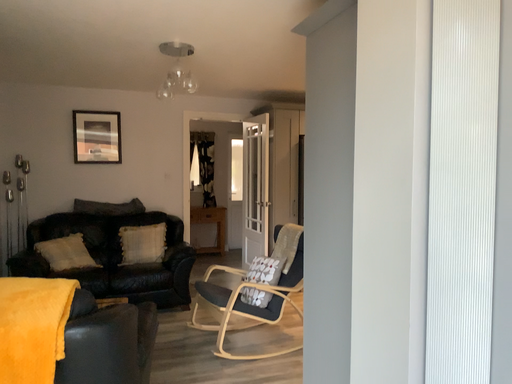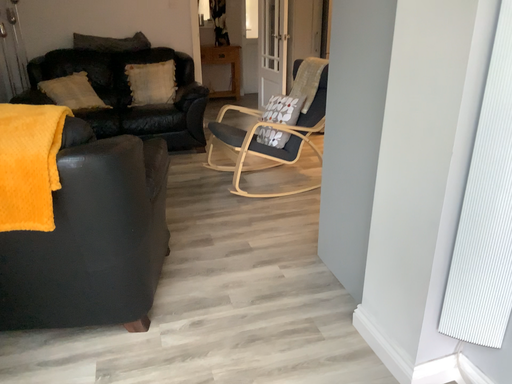
Question: How did the camera likely rotate when shooting the video?

Choices:
 (A) rotated downward
 (B) rotated upward

Answer: (A)